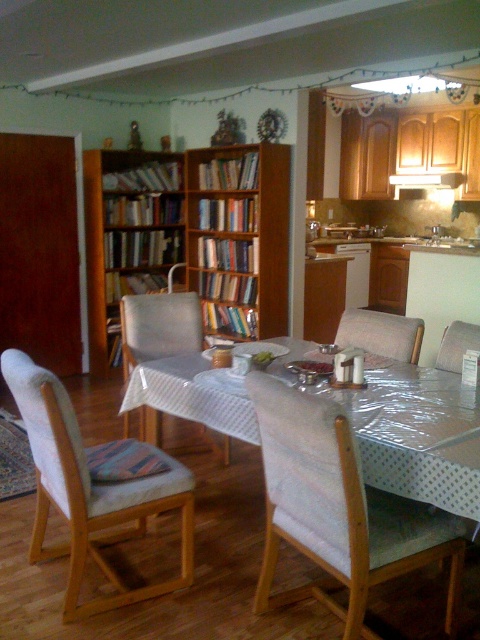
You are standing in the dining area and want to pick up an item from the table. You notice two points on the table surface. One is at point coordinates point [105,230] and the other is at point coordinates point [453,371]. Which point is closer to you?

Point [105,230] is closer to you because it is further to the viewer than point [453,371].